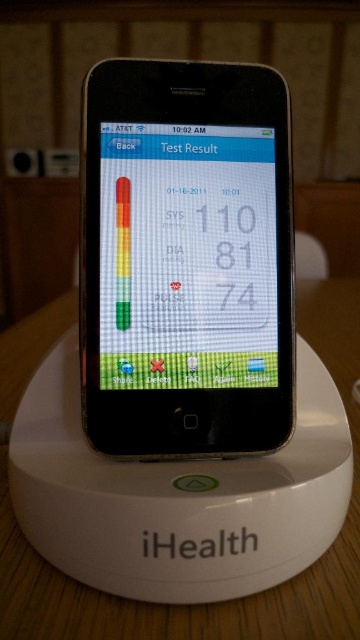
Can you confirm if matte plastic screen at center is positioned above white matte table at center?

Indeed, matte plastic screen at center is positioned over white matte table at center.

Between matte plastic screen at center and white matte table at center, which one is positioned higher?

matte plastic screen at center is above.

Between point (164, 248) and point (28, 573), which one is positioned in front?

Point (28, 573)

Find the location of `matte plastic screen at center`. matte plastic screen at center is located at coordinates (186, 257).